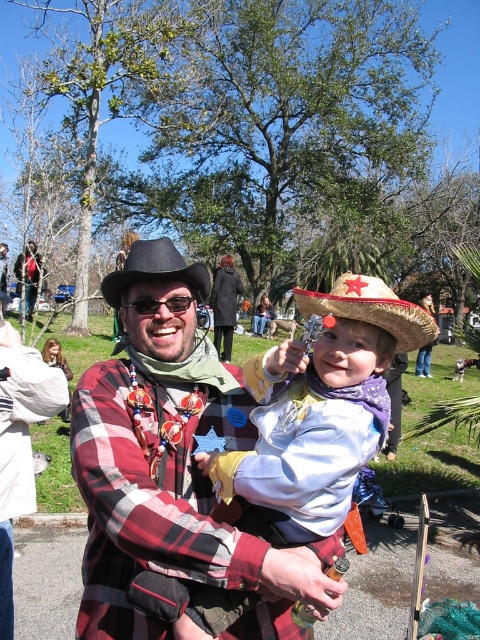
Question: Which point appears farthest from the camera in this image?

Choices:
 (A) (163, 534)
 (B) (389, 294)
 (C) (153, 257)

Answer: (C)

Question: Observing the image, what is the correct spatial positioning of plaid fabric shirt at center in reference to black felt cowboy hat at center?

Choices:
 (A) above
 (B) below

Answer: (B)

Question: Where is plaid fabric shirt at center located in relation to black felt cowboy hat at center in the image?

Choices:
 (A) below
 (B) above

Answer: (A)

Question: Which object appears farthest from the camera in this image?

Choices:
 (A) glittery straw hat at center
 (B) black felt cowboy hat at center

Answer: (B)

Question: Which point appears closest to the camera in this image?

Choices:
 (A) coord(179,428)
 (B) coord(110,278)

Answer: (A)

Question: Is plaid fabric shirt at center in front of black felt cowboy hat at center?

Choices:
 (A) yes
 (B) no

Answer: (A)